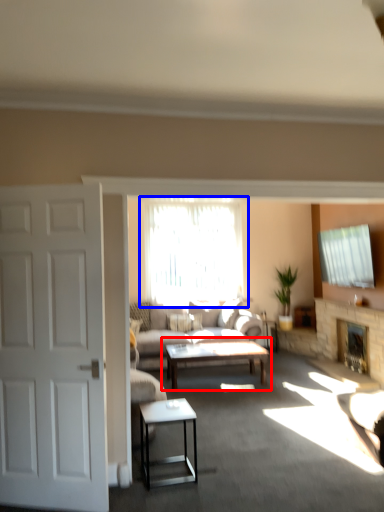
Question: Which of the following is the farthest to the observer, coffee table (highlighted by a red box) or window (highlighted by a blue box)?

Choices:
 (A) coffee table
 (B) window

Answer: (B)